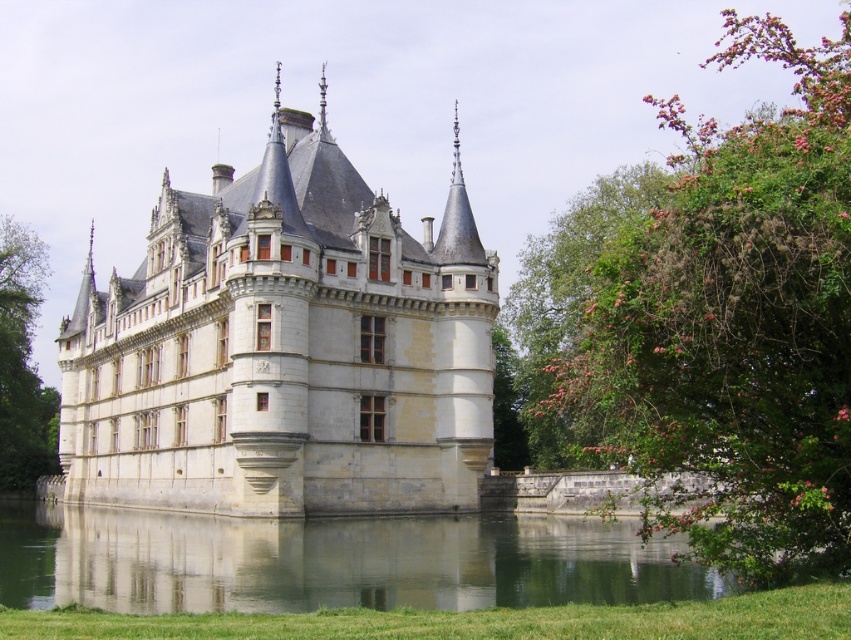
Between white stone castle at center and green leafy tree at left, which one appears on the left side from the viewer's perspective?

From the viewer's perspective, green leafy tree at left appears more on the left side.

Does white stone castle at center have a larger size compared to green leafy tree at left?

Correct, white stone castle at center is larger in size than green leafy tree at left.

What are the coordinates of `white stone castle at center` in the screenshot? It's located at (284, 348).

The height and width of the screenshot is (640, 851). What do you see at coordinates (714, 317) in the screenshot?
I see `green leafy bush at right` at bounding box center [714, 317].

Which of these two, green leafy bush at right or transparent water at lower center, stands shorter?

With less height is transparent water at lower center.

Describe the element at coordinates (714, 317) in the screenshot. The width and height of the screenshot is (851, 640). I see `green leafy bush at right` at that location.

This screenshot has width=851, height=640. What are the coordinates of `green leafy bush at right` in the screenshot? It's located at (714, 317).

Can you confirm if transparent water at lower center is positioned to the left of green leafy tree at left?

Incorrect, transparent water at lower center is not on the left side of green leafy tree at left.

Which of these two, transparent water at lower center or green leafy tree at left, stands taller?

Standing taller between the two is green leafy tree at left.

Where is `transparent water at lower center`? transparent water at lower center is located at coordinates (330, 563).

Identify the location of transparent water at lower center. The height and width of the screenshot is (640, 851). (330, 563).